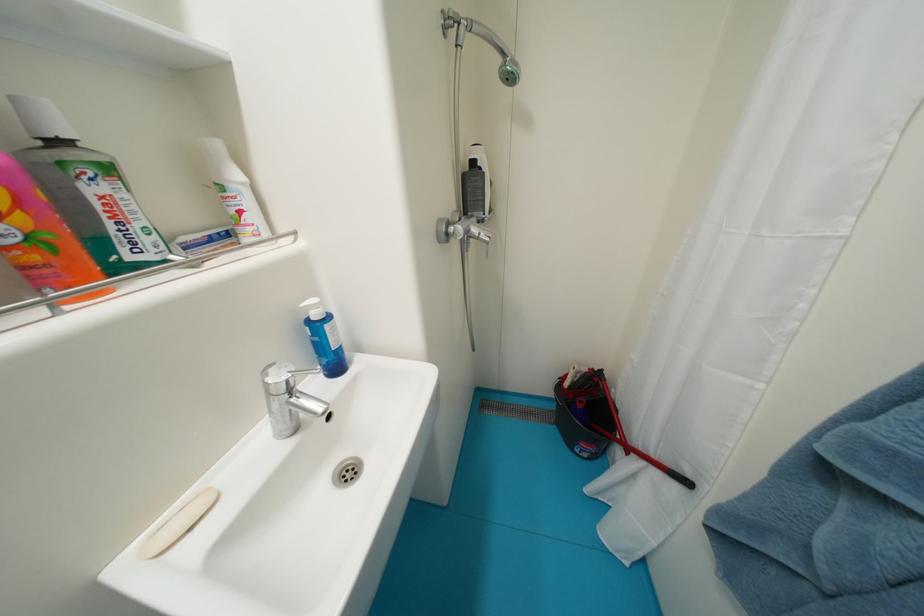
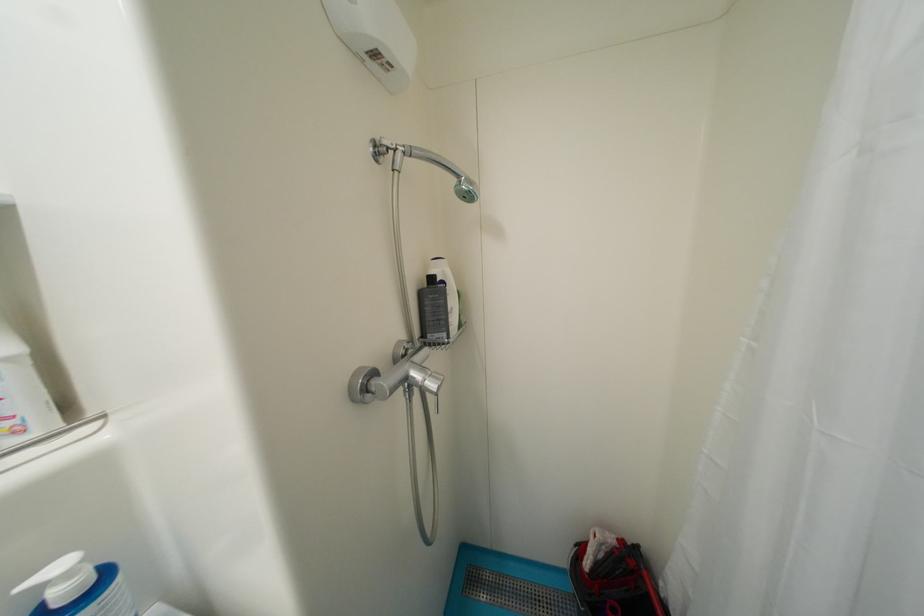
Where in the second image is the point corresponding to pixel 480 164 from the first image?

(439, 281)